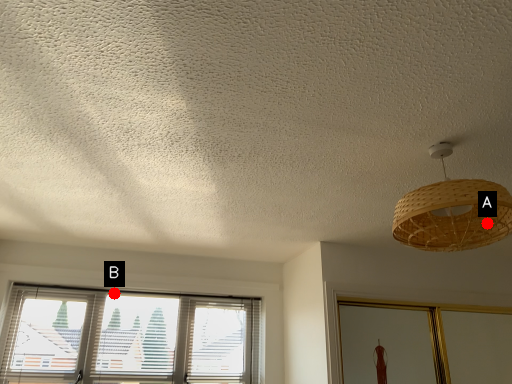
Question: Two points are circled on the image, labeled by A and B beside each circle. Which point is farther to the camera?

Choices:
 (A) A is further
 (B) B is further

Answer: (B)